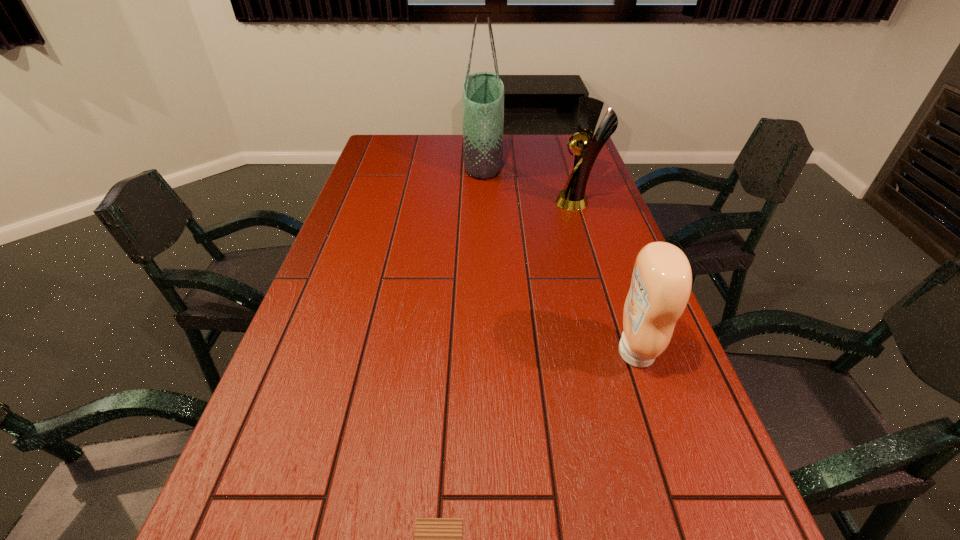
The width and height of the screenshot is (960, 540). I want to click on the second closest object to the tallest object, so click(x=661, y=283).